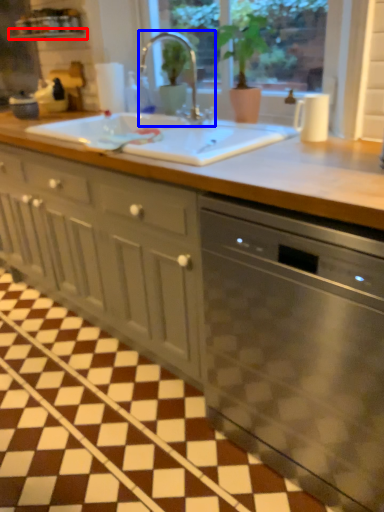
Question: Among these objects, which one is farthest to the camera, window sill (highlighted by a red box) or tap (highlighted by a blue box)?

Choices:
 (A) window sill
 (B) tap

Answer: (A)